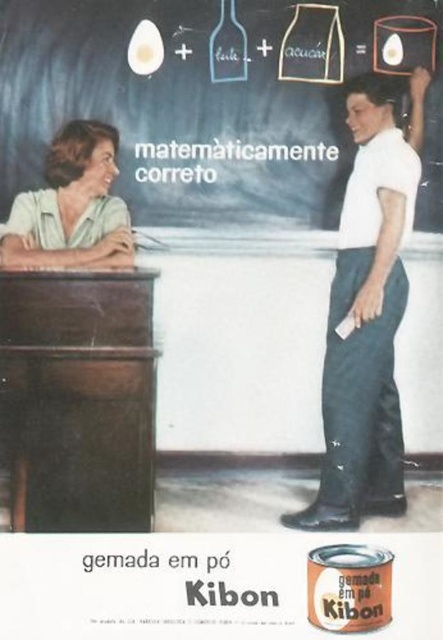
You are a student sitting in the classroom depicted in the scene. You need to write something on the chalkboard at upper center. Can you reach it while standing on the white smooth shirt at center?

The chalkboard at upper center is positioned over the white smooth shirt at center, meaning it is higher up. Since the shirt is part of the man standing below it, you cannot use the shirt to reach the chalkboard.

In the vintage Kibon advertisement scene, there is a chalkboard at upper center and a white smooth shirt at center. From the observer standing in front of the desk, which object is positioned to the left?

The chalkboard at upper center is to the left of the white smooth shirt at center.